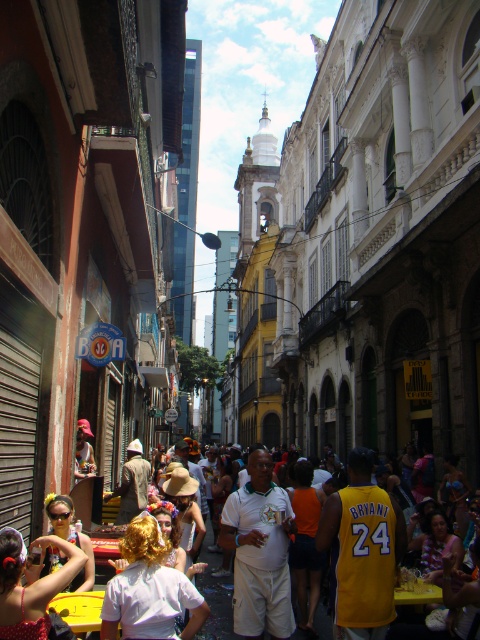
Question: Considering the relative positions of white cotton shirt at center and matte yellow sunglasses at center in the image provided, where is white cotton shirt at center located with respect to matte yellow sunglasses at center?

Choices:
 (A) below
 (B) above

Answer: (A)

Question: Which of the following is the farthest from the observer?

Choices:
 (A) white cotton shirt at center
 (B) white matte shirt at center
 (C) matte yellow sunglasses at center

Answer: (C)

Question: Which of the following is the farthest from the observer?

Choices:
 (A) white matte shirt at center
 (B) white cotton shirt at lower left
 (C) white cotton shirt at center

Answer: (C)

Question: Among these objects, which one is nearest to the camera?

Choices:
 (A) white cotton shirt at center
 (B) white matte shirt at center
 (C) matte yellow sunglasses at center

Answer: (B)

Question: Can you confirm if white cotton shirt at lower left is positioned below matte yellow sunglasses at center?

Choices:
 (A) no
 (B) yes

Answer: (A)

Question: Does white matte shirt at center have a larger size compared to white cotton shirt at lower left?

Choices:
 (A) yes
 (B) no

Answer: (A)